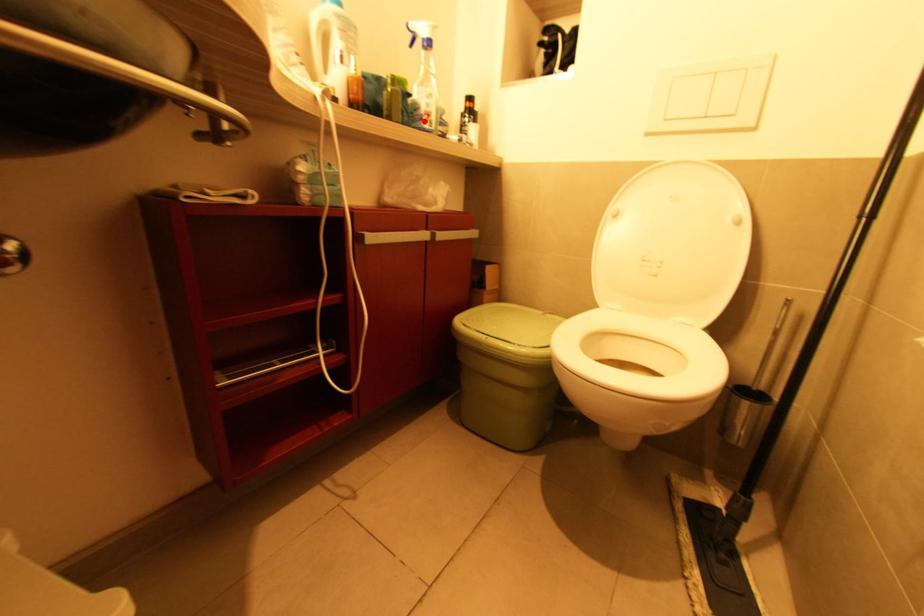
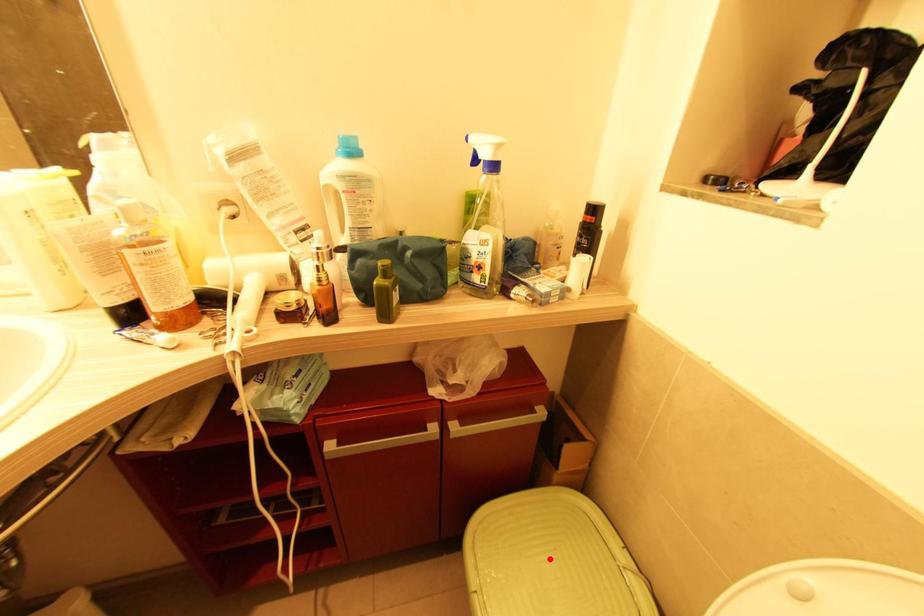
I am providing you with two images of the same scene from different viewpoints. A red point is marked on the first image and another point is marked on the second image. Are the points marked in image1 and image2 representing the same 3D position?

No